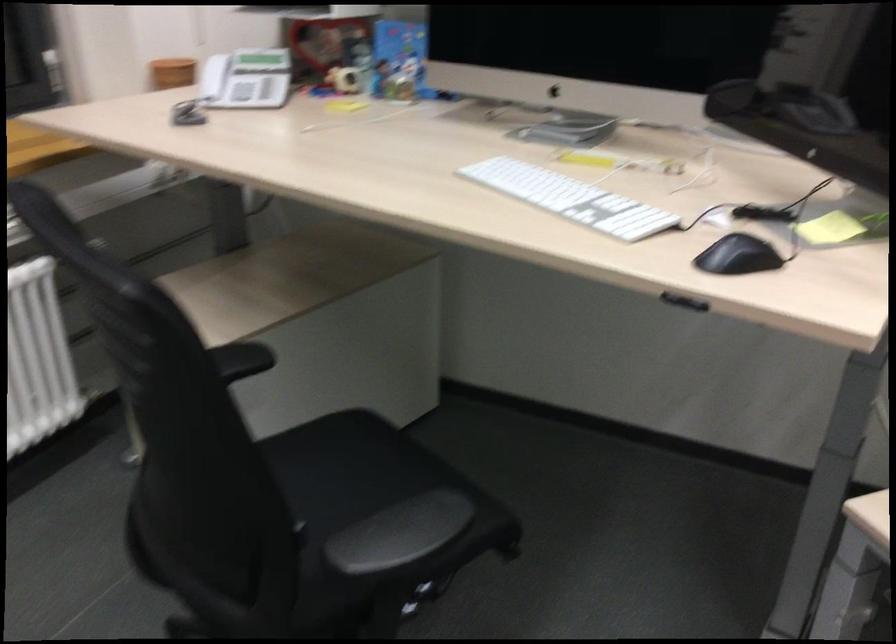
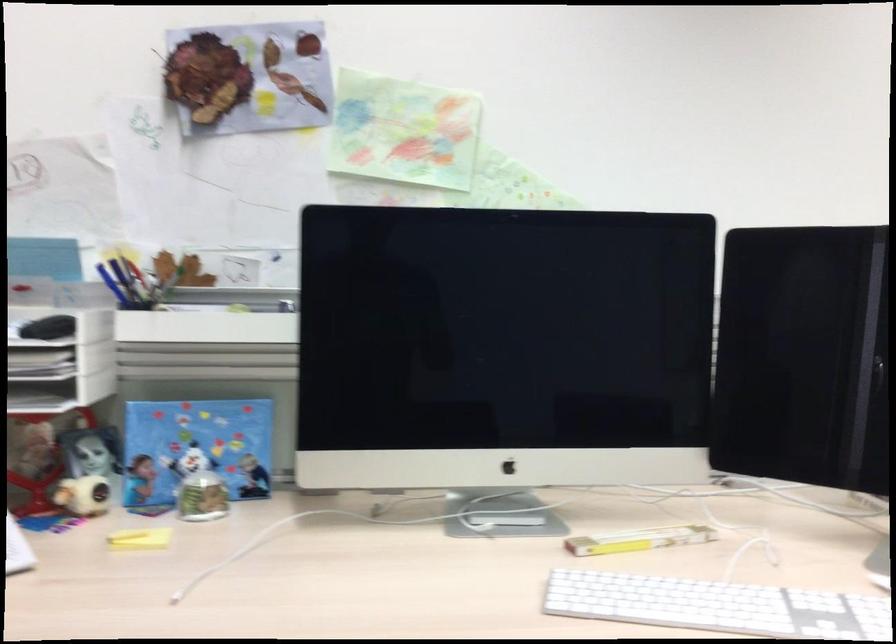
Find the pixel in the second image that matches the point at 343,106 in the first image.

(140, 538)